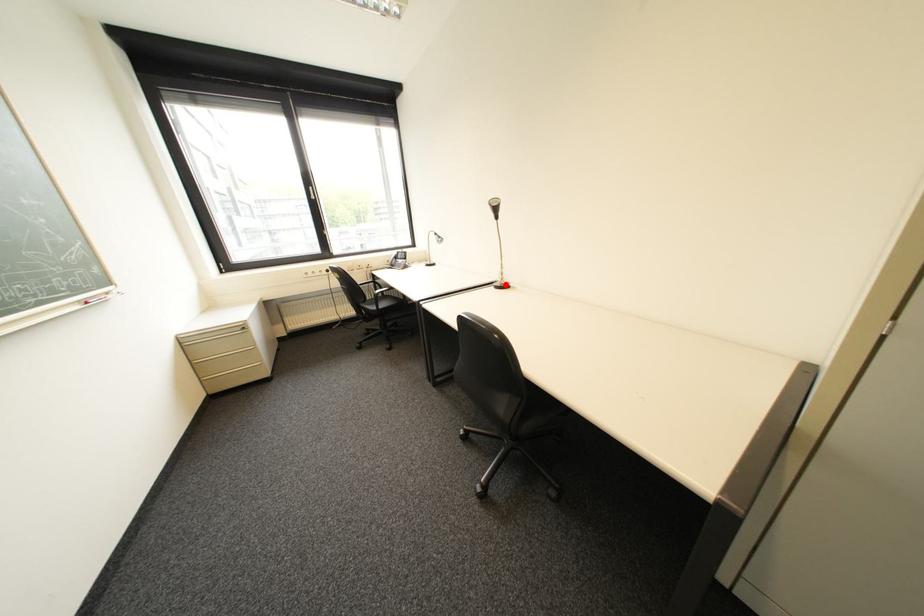
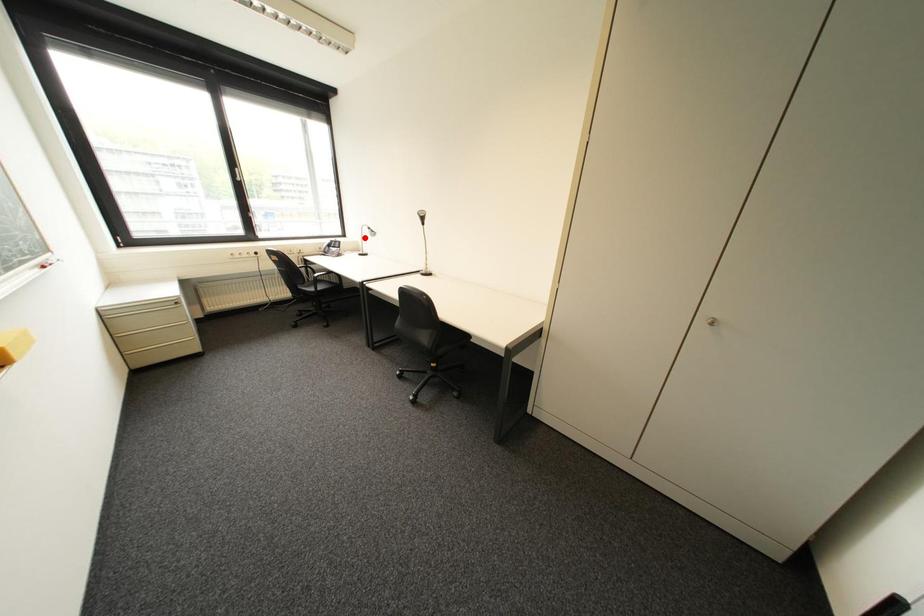
I am providing you with two images of the same scene from different viewpoints. A red point is marked on the first image and another point is marked on the second image. Are the points marked in image1 and image2 representing the same 3D position?

No